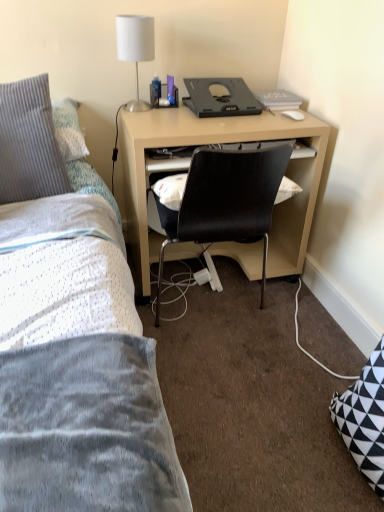
Question: Is gray ribbed pillow at upper left taller or shorter than black plastic desktop at center?

Choices:
 (A) tall
 (B) short

Answer: (A)

Question: Is gray ribbed pillow at upper left situated inside black plastic desktop at center or outside?

Choices:
 (A) outside
 (B) inside

Answer: (A)

Question: Based on their relative distances, which object is farther from the white fabric lampshade at upper center?

Choices:
 (A) gray ribbed pillow at upper left
 (B) black plastic desktop at center
 (C) matte wood computer desk at center

Answer: (C)

Question: Based on their relative distances, which object is farther from the gray ribbed pillow at upper left?

Choices:
 (A) matte wood computer desk at center
 (B) black plastic desktop at center
 (C) white fabric lampshade at upper center

Answer: (B)